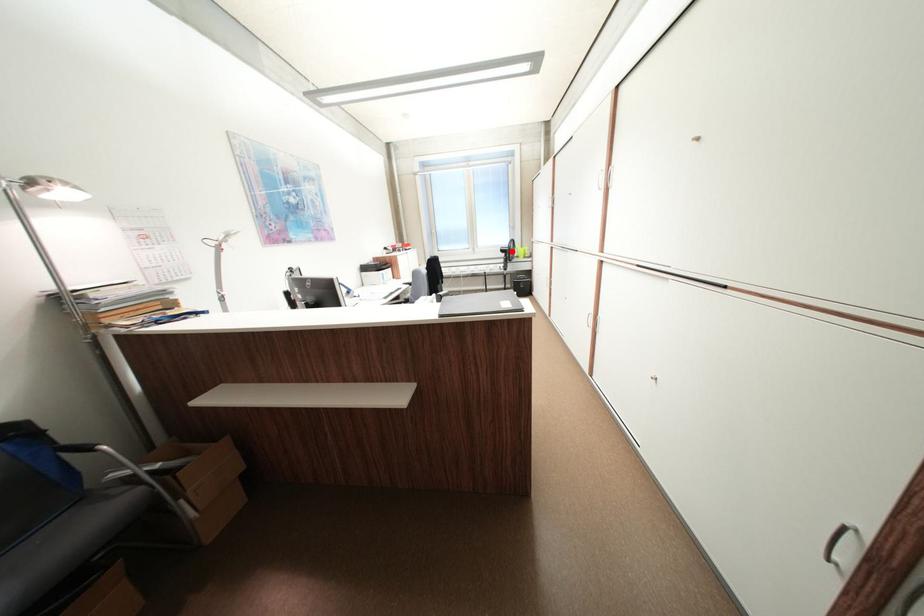
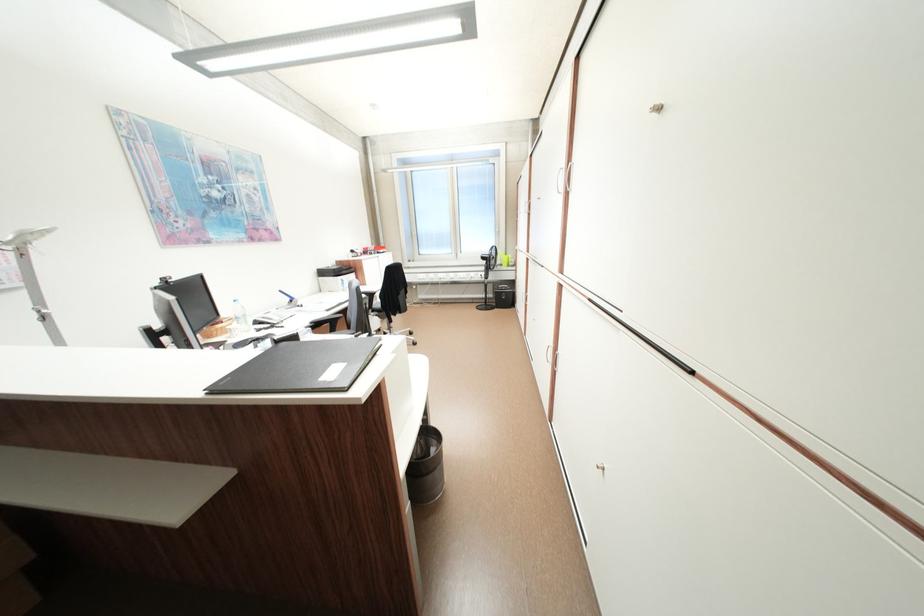
The point at the highlighted location is marked in the first image. Where is the corresponding point in the second image?

(492, 259)